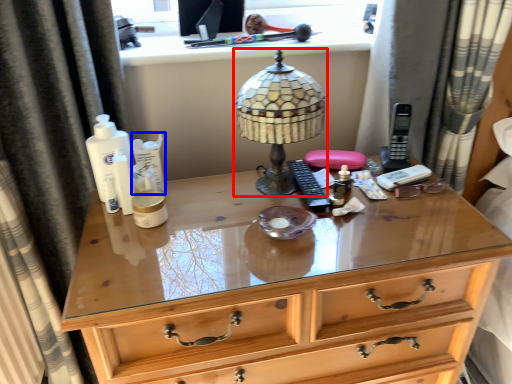
Question: Which object appears closest to the camera in this image, lamp (highlighted by a red box) or toiletry (highlighted by a blue box)?

Choices:
 (A) lamp
 (B) toiletry

Answer: (A)